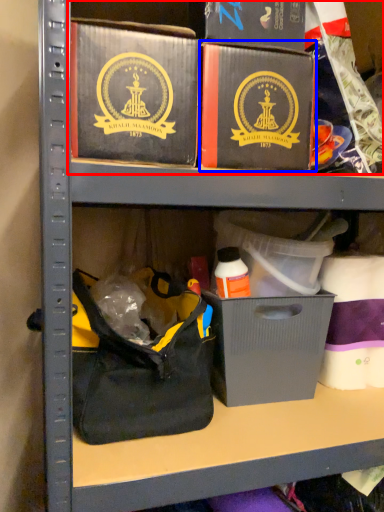
Question: Which point is further to the camera, collection (highlighted by a red box) or box (highlighted by a blue box)?

Choices:
 (A) collection
 (B) box

Answer: (A)